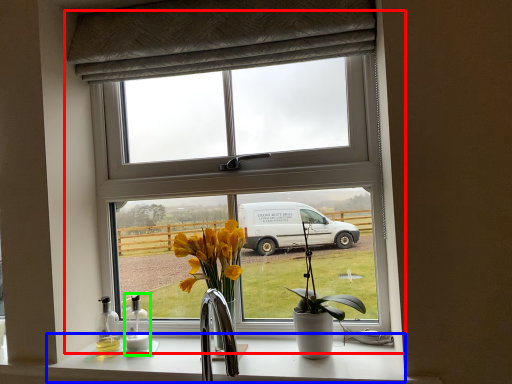
Question: Which object is the farthest from window (highlighted by a red box)? Choose among these: counter top (highlighted by a blue box) or bottle (highlighted by a green box).

Choices:
 (A) counter top
 (B) bottle

Answer: (B)